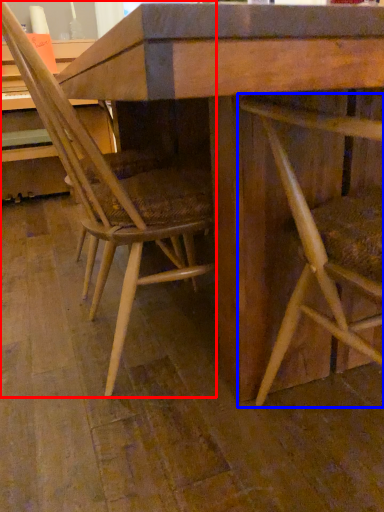
Question: Which object appears farthest to the camera in this image, chair (highlighted by a red box) or chair (highlighted by a blue box)?

Choices:
 (A) chair
 (B) chair

Answer: (A)